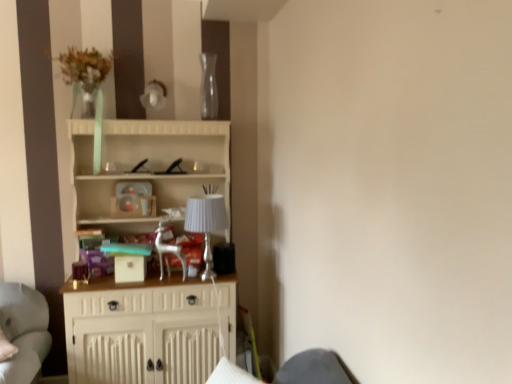
Question: From a real-world perspective, is white wood cupboard at center physically above silver metallic lamp at center?

Choices:
 (A) yes
 (B) no

Answer: (B)

Question: Can you confirm if white wood cupboard at center is thinner than silver metallic lamp at center?

Choices:
 (A) no
 (B) yes

Answer: (A)

Question: Does white wood cupboard at center have a greater height compared to silver metallic lamp at center?

Choices:
 (A) yes
 (B) no

Answer: (A)

Question: From a real-world perspective, does white wood cupboard at center sit lower than silver metallic lamp at center?

Choices:
 (A) no
 (B) yes

Answer: (B)

Question: Considering the relative positions of white wood cupboard at center and silver metallic lamp at center in the image provided, is white wood cupboard at center behind silver metallic lamp at center?

Choices:
 (A) no
 (B) yes

Answer: (A)

Question: Is white wood cupboard at center not within silver metallic lamp at center?

Choices:
 (A) no
 (B) yes

Answer: (B)

Question: Can you confirm if silver metallic lamp at center is positioned to the left of white wood cupboard at center?

Choices:
 (A) yes
 (B) no

Answer: (B)

Question: Is white wood cupboard at center completely or partially inside silver metallic lamp at center?

Choices:
 (A) no
 (B) yes

Answer: (A)

Question: Considering the relative sizes of silver metallic lamp at center and white wood cupboard at center in the image provided, is silver metallic lamp at center smaller than white wood cupboard at center?

Choices:
 (A) yes
 (B) no

Answer: (A)

Question: From a real-world perspective, is silver metallic lamp at center located higher than white wood cupboard at center?

Choices:
 (A) no
 (B) yes

Answer: (B)

Question: Is the position of silver metallic lamp at center less distant than that of white wood cupboard at center?

Choices:
 (A) yes
 (B) no

Answer: (B)

Question: Can we say silver metallic lamp at center lies outside white wood cupboard at center?

Choices:
 (A) yes
 (B) no

Answer: (B)

Question: From a real-world perspective, is silver metallic lamp at center positioned above or below white wood cupboard at center?

Choices:
 (A) below
 (B) above

Answer: (B)